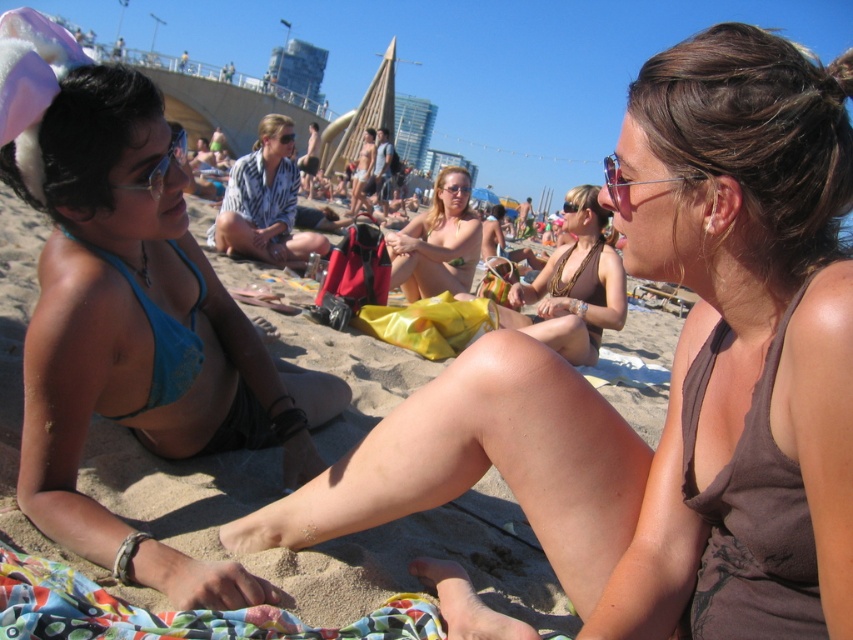
Question: Can you confirm if brown fabric bikini at right is positioned to the left of matte skin bikini at center?

Choices:
 (A) yes
 (B) no

Answer: (B)

Question: Can you confirm if brown textured tank top at center is thinner than brown fabric bikini at right?

Choices:
 (A) no
 (B) yes

Answer: (A)

Question: Which object is positioned closest to the printed fabric blanket at lower left?

Choices:
 (A) blue lace bikini top at left
 (B) brown textured bikini top at center
 (C) brown textured tank top at center

Answer: (C)

Question: Among these points, which one is farthest from the camera?

Choices:
 (A) (80, 621)
 (B) (175, 394)
 (C) (757, 182)

Answer: (B)

Question: Considering the real-world distances, which object is closest to the blue fabric bikini top at left?

Choices:
 (A) blue lace bikini top at left
 (B) matte skin bikini at center

Answer: (A)

Question: In this image, where is blue fabric bikini top at left located relative to printed fabric blanket at lower left?

Choices:
 (A) right
 (B) left

Answer: (B)